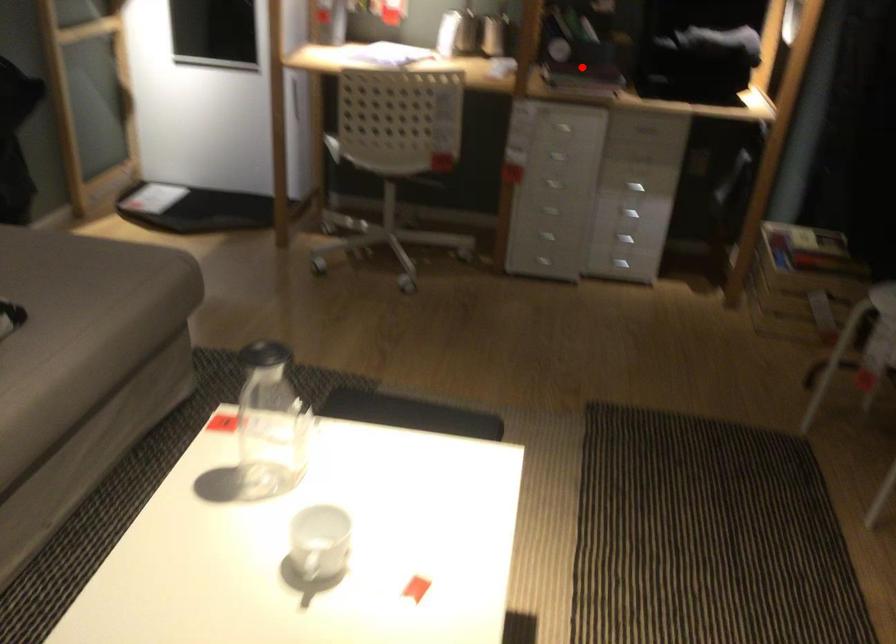
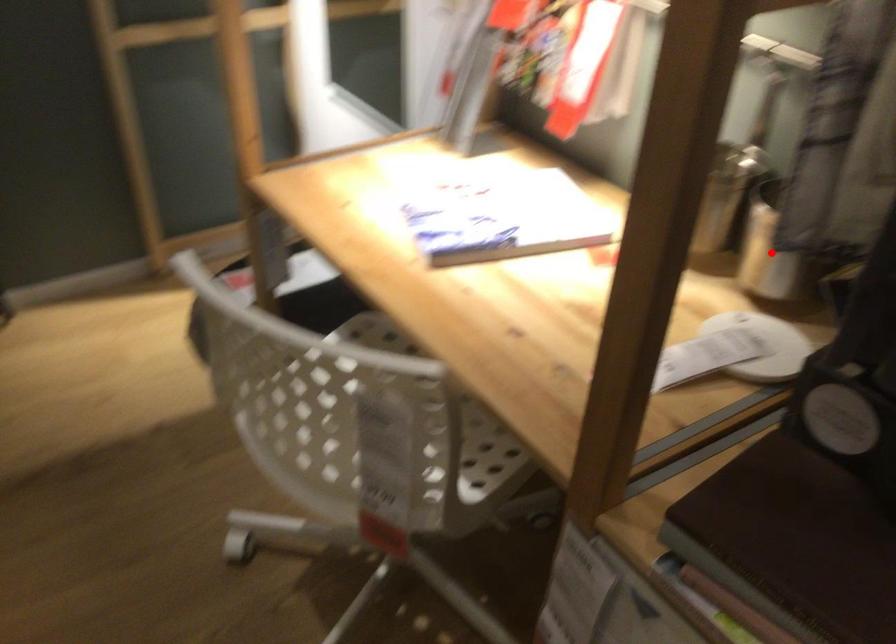
Based on the photo, I am providing you with two images of the same scene from different viewpoints. A red point is marked on the first image and another point is marked on the second image. Is the red point in image1 aligned with the point shown in image2?

No